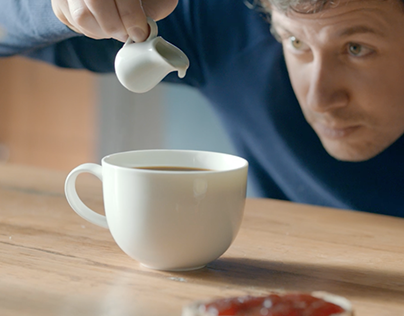
I want to click on white liquid in tiny white pitcher, so click(x=181, y=73).